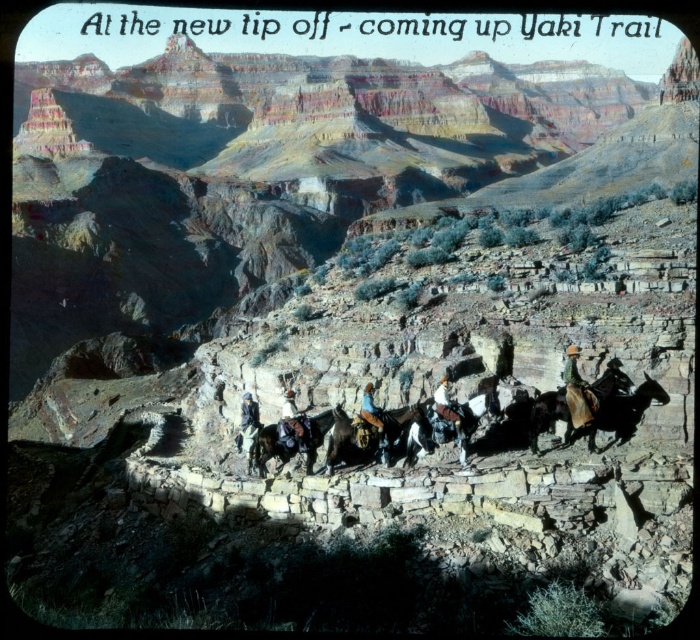
Can you confirm if brown leather jacket at center is smaller than leather jacket at center?

No.

Identify the location of brown leather jacket at center. This screenshot has height=640, width=700. (578, 392).

Where is `brown leather jacket at center`? Image resolution: width=700 pixels, height=640 pixels. brown leather jacket at center is located at coordinates (578, 392).

Between brown leather saddle at center and leather cowboy hat at center, which one appears on the right side from the viewer's perspective?

Positioned to the right is brown leather saddle at center.

Is brown leather saddle at center wider than leather cowboy hat at center?

Correct, the width of brown leather saddle at center exceeds that of leather cowboy hat at center.

Locate an element on the screen. brown leather saddle at center is located at coordinates (368, 435).

Between point (430, 433) and point (568, 362), which one is positioned behind?

The point (568, 362) is more distant.

Is white glossy horse at center taller than brown leather jacket at center?

No.

The image size is (700, 640). Identify the location of white glossy horse at center. (444, 428).